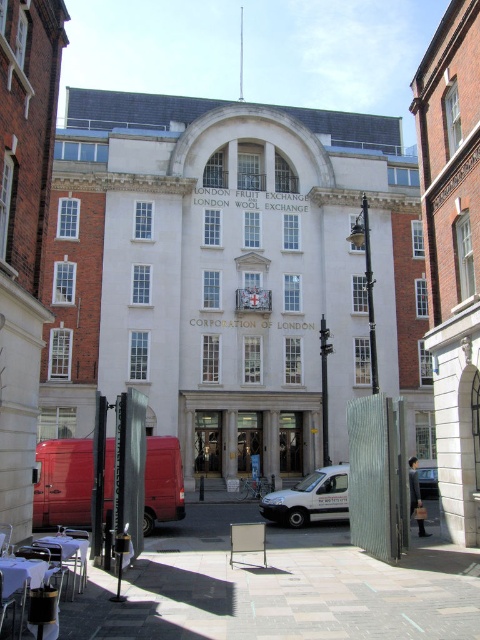
Question: Which point is closer to the camera?

Choices:
 (A) (12, 577)
 (B) (302, 492)
 (C) (436, 476)
 (D) (70, 548)

Answer: (A)

Question: Can you confirm if polished brass door at center is positioned above metallic silver table at lower left?

Choices:
 (A) yes
 (B) no

Answer: (B)

Question: Does white matte van at center have a larger size compared to metallic silver van at center?

Choices:
 (A) yes
 (B) no

Answer: (A)

Question: Which point is closer to the camera taking this photo?

Choices:
 (A) coord(280,512)
 (B) coord(67,538)
 (C) coord(23,596)

Answer: (C)

Question: Can you confirm if metallic silver table at lower left is wider than metallic silver van at center?

Choices:
 (A) no
 (B) yes

Answer: (A)

Question: Estimate the real-world distances between objects in this image. Which object is farther from the white matte van at center?

Choices:
 (A) metallic silver table at lower left
 (B) polished brass door at center
 (C) metallic silver van at center
 (D) wooden table at lower left

Answer: (D)